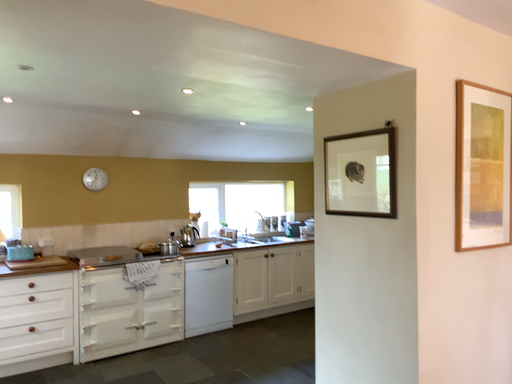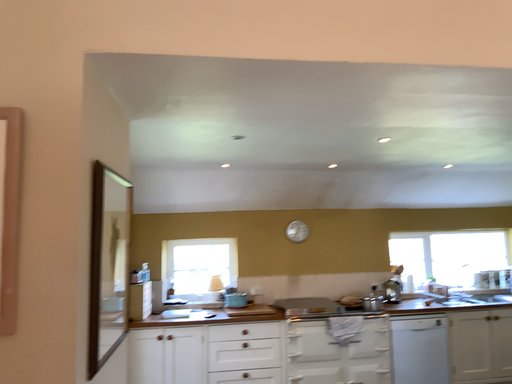
Question: How did the camera likely rotate when shooting the video?

Choices:
 (A) rotated downward
 (B) rotated upward

Answer: (B)